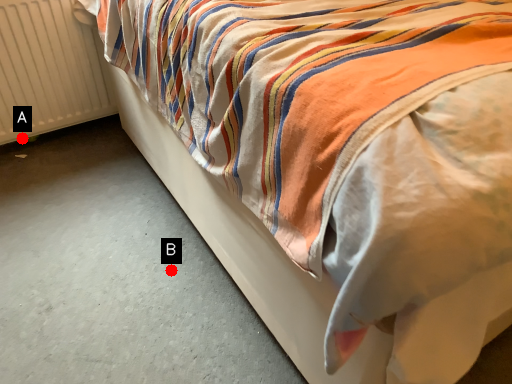
Question: Two points are circled on the image, labeled by A and B beside each circle. Which point appears closest to the camera in this image?

Choices:
 (A) A is closer
 (B) B is closer

Answer: (B)